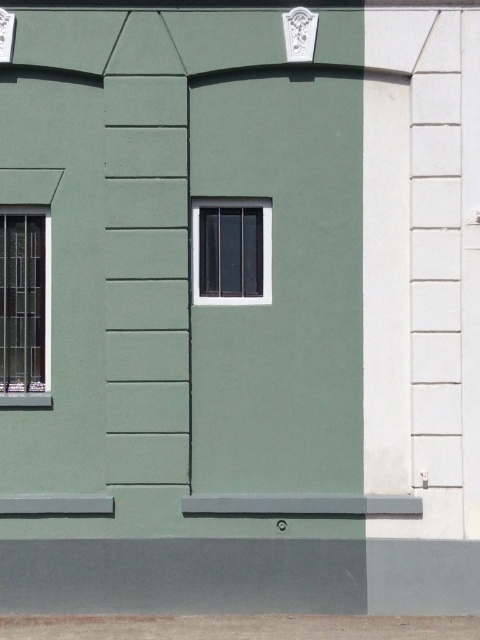
Question: Where is metallic grid window at left located in relation to matte black window at center in the image?

Choices:
 (A) below
 (B) above

Answer: (A)

Question: Does metallic grid window at left have a smaller size compared to matte black window at center?

Choices:
 (A) no
 (B) yes

Answer: (A)

Question: Can you confirm if metallic grid window at left is positioned to the right of matte black window at center?

Choices:
 (A) yes
 (B) no

Answer: (B)